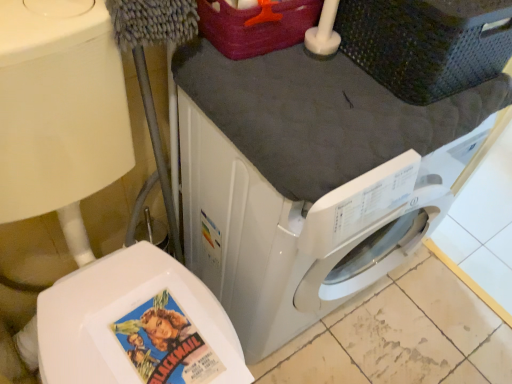
Question: Is white glossy washing machine at center inside the boundaries of matte paper comic book at lower left, or outside?

Choices:
 (A) inside
 (B) outside

Answer: (B)

Question: From the image's perspective, is white glossy washing machine at center located above or below matte paper comic book at lower left?

Choices:
 (A) above
 (B) below

Answer: (A)

Question: Estimate the real-world distances between objects in this image. Which object is closer to the dark gray plastic basket at upper right?

Choices:
 (A) matte paper comic book at lower left
 (B) white glossy washing machine at center

Answer: (B)

Question: Which of these objects is positioned farthest from the matte paper comic book at lower left?

Choices:
 (A) dark gray plastic basket at upper right
 (B) white glossy washing machine at center

Answer: (A)